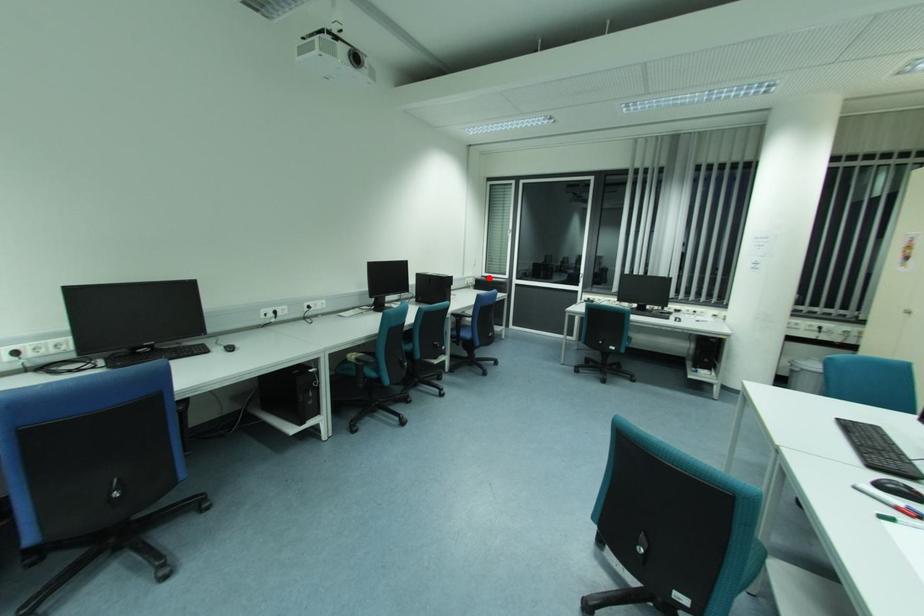
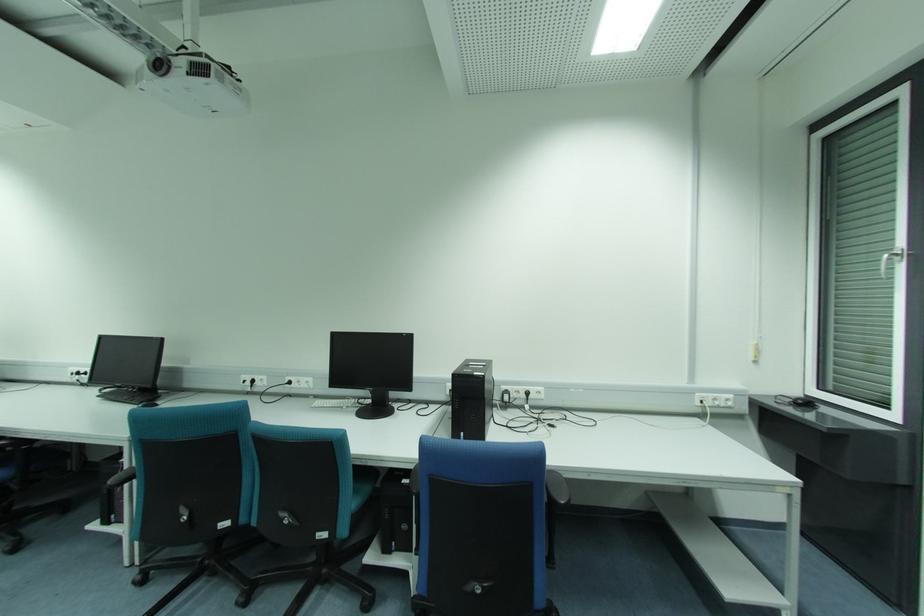
Locate, in the second image, the point that corresponds to the highlighted location in the first image.

(808, 403)